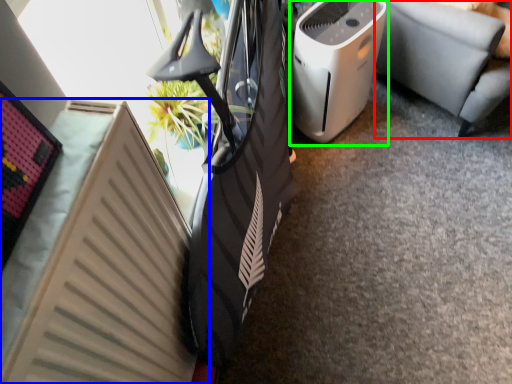
Question: Estimate the real-world distances between objects in this image. Which object is farther from furniture (highlighted by a red box), radiator (highlighted by a blue box) or home appliance (highlighted by a green box)?

Choices:
 (A) radiator
 (B) home appliance

Answer: (A)